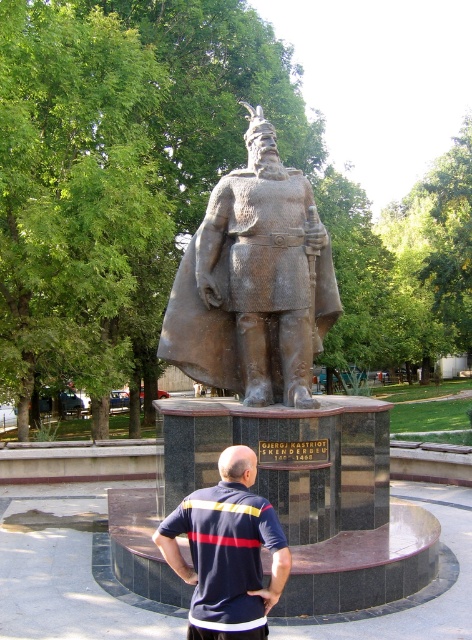
You are a photographer trying to capture a full body shot of the bronze statue at center and the dark blue shirt at center in the same frame. Considering their heights, which object will require you to adjust your camera angle more to ensure it fits in the frame?

The bronze statue at center is much taller than the dark blue shirt at center, so you will need to adjust your camera angle more to accommodate the height of the bronze statue at center.

You are a drone operator flying a drone that is 2 meters wide. You want to fly your drone between the two points marked as point (160, 332) and another point. Can you safely fly your drone through the space between them?

The two points marked as point (160, 332) are 19.93 meters apart, so yes, the drone can safely fly through the space between them since the distance is greater than the drone width.